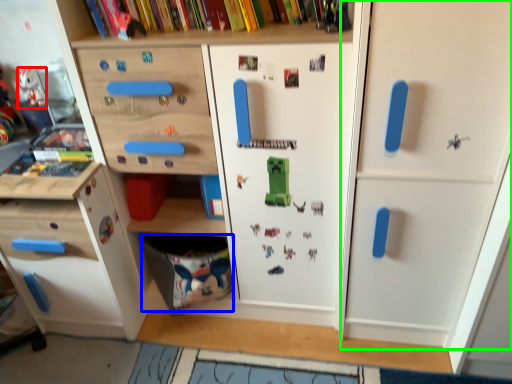
Question: Which object is the closest to the toy (highlighted by a red box)? Choose among these: drawer (highlighted by a blue box) or door (highlighted by a green box).

Choices:
 (A) drawer
 (B) door

Answer: (A)